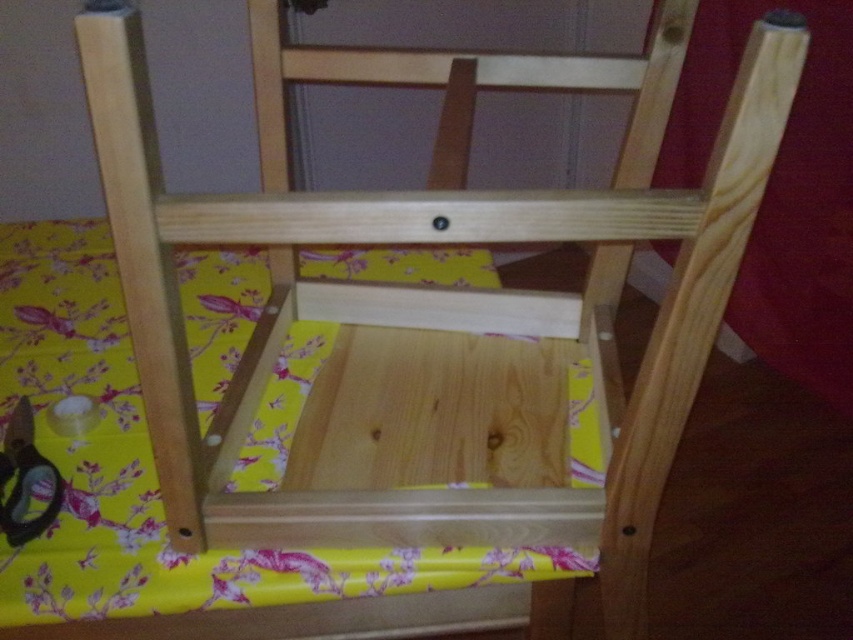
You are holding a small object that is 3 inches in diameter. You want to place it on the point at coordinates point (x=141, y=589). Will it fit there?

The point (x=141, y=589) is 23.72 inches away from the camera, so placing a 3 inch diameter object there will fit since the space is more than enough.

You are trying to determine if the yellow floral fabric at center can cover the entire surface of the metallic sheen scissors at lower left. Based on their sizes, is this possible?

The yellow floral fabric at center might be wider than metallic sheen scissors at lower left, so it is possible that the fabric could cover the scissors completely.

You are standing in front of the wooden chair with the yellow fabric. There is a point marked at coordinates (154, 472). What object is located at that point?

The point at coordinates (154, 472) is where the yellow floral fabric at center is located.